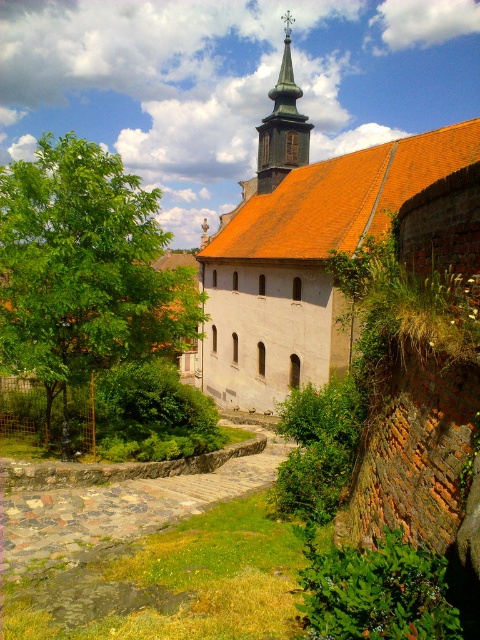
Which is behind, point (394, 156) or point (272, 115)?

Positioned behind is point (272, 115).

Which is more to the left, orange tiled roof at center or green wooden spire at upper center?

orange tiled roof at center is more to the left.

Between point (328, 289) and point (294, 104), which one is positioned behind?

The point (294, 104) is more distant.

This screenshot has width=480, height=640. Identify the location of orange tiled roof at center. (301, 248).

Does green leafy tree at left have a smaller size compared to green wooden spire at upper center?

Incorrect, green leafy tree at left is not smaller in size than green wooden spire at upper center.

Is green leafy tree at left thinner than green wooden spire at upper center?

Incorrect, green leafy tree at left's width is not less than green wooden spire at upper center's.

The width and height of the screenshot is (480, 640). In order to click on green leafy tree at left in this screenshot , I will do `click(84, 269)`.

Does orange tiled roof at center have a greater width compared to green leafy tree at left?

Indeed, orange tiled roof at center has a greater width compared to green leafy tree at left.

Is the position of orange tiled roof at center less distant than that of green leafy tree at left?

No.

Locate an element on the screen. orange tiled roof at center is located at coordinates (301, 248).